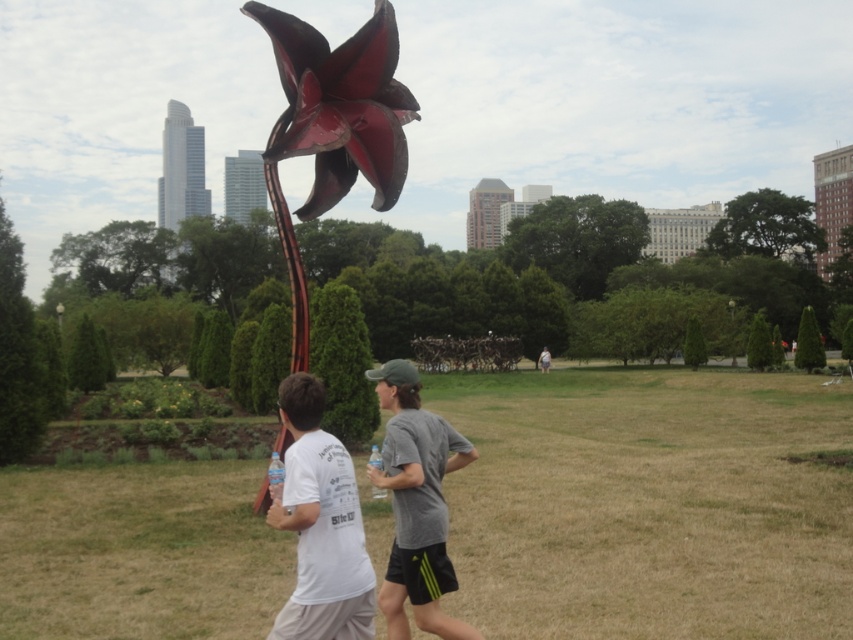
Question: Which of the following is the farthest from the observer?

Choices:
 (A) (405, 424)
 (B) (328, 621)

Answer: (A)

Question: Which point is closer to the camera?

Choices:
 (A) (393, 410)
 (B) (280, 611)

Answer: (A)

Question: Considering the relative positions of white matte t-shirt at center and gray fabric shirt at center in the image provided, where is white matte t-shirt at center located with respect to gray fabric shirt at center?

Choices:
 (A) below
 (B) above

Answer: (B)

Question: Which of the following is the farthest from the observer?

Choices:
 (A) white matte t-shirt at center
 (B) gray fabric shirt at center

Answer: (B)

Question: Is white matte t-shirt at center wider than gray fabric shirt at center?

Choices:
 (A) yes
 (B) no

Answer: (B)

Question: Is white matte t-shirt at center positioned behind gray fabric shirt at center?

Choices:
 (A) no
 (B) yes

Answer: (A)